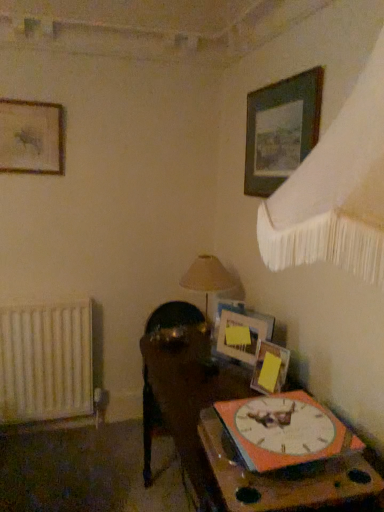
I want to click on free space that is to the left of wooden picture frame at center, the first picture frame from the bottom, so click(227, 380).